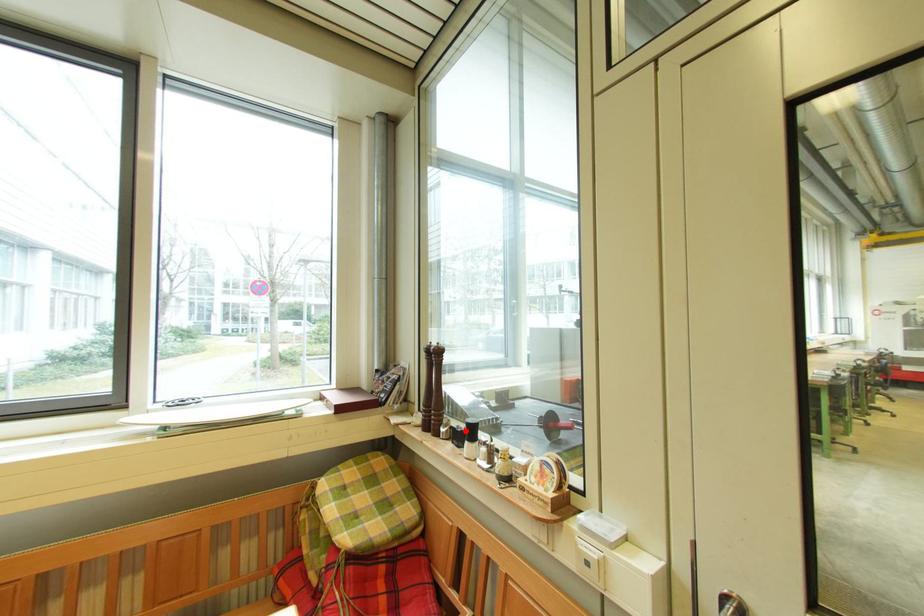
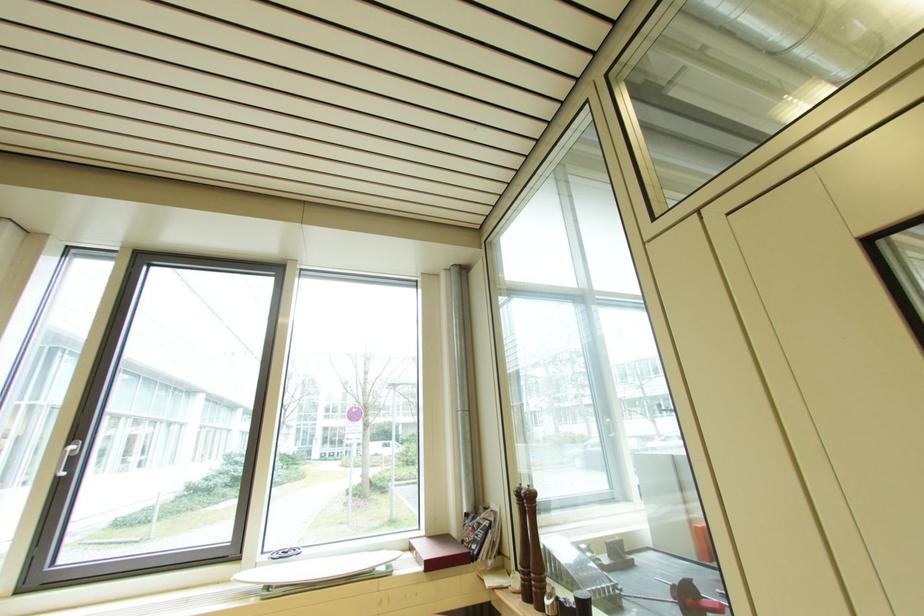
Locate, in the second image, the point that corresponds to the highlighted location in the first image.

(574, 605)